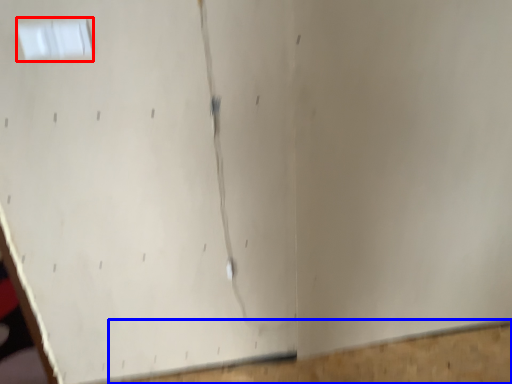
Question: Which point is further to the camera, window (highlighted by a red box) or plywood (highlighted by a blue box)?

Choices:
 (A) window
 (B) plywood

Answer: (B)